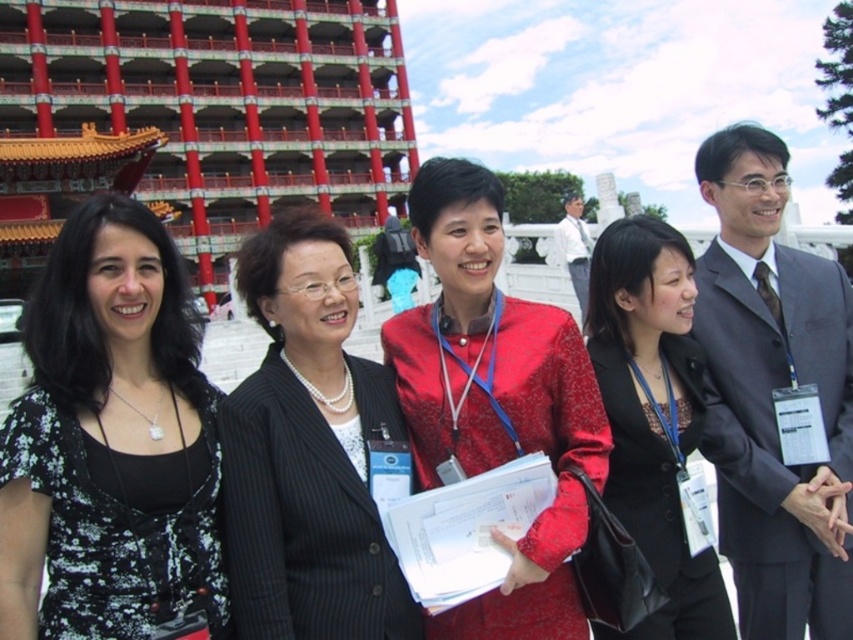
Between black floral dress at left and black glossy blazer at center, which one is positioned lower?

black glossy blazer at center is lower down.

Does black floral dress at left have a lesser height compared to black glossy blazer at center?

Indeed, black floral dress at left has a lesser height compared to black glossy blazer at center.

Find the location of `black floral dress at left`. black floral dress at left is located at coordinates (109, 442).

Where is `black floral dress at left`? This screenshot has height=640, width=853. black floral dress at left is located at coordinates (109, 442).

Who is positioned more to the right, red painted stone palace at upper left or black pinstripe blazer at center?

black pinstripe blazer at center

Can you confirm if red painted stone palace at upper left is smaller than black pinstripe blazer at center?

Incorrect, red painted stone palace at upper left is not smaller in size than black pinstripe blazer at center.

Does point (222, 266) come farther from viewer compared to point (328, 545)?

Yes.

I want to click on red painted stone palace at upper left, so [x=198, y=118].

Can you confirm if matte red dress at center is shorter than black glossy blazer at center?

No.

Looking at this image, does matte red dress at center come behind black glossy blazer at center?

Yes, matte red dress at center is behind black glossy blazer at center.

Which is in front, point (447, 400) or point (698, 355)?

Point (447, 400)

Locate an element on the screen. matte red dress at center is located at coordinates [x=496, y=400].